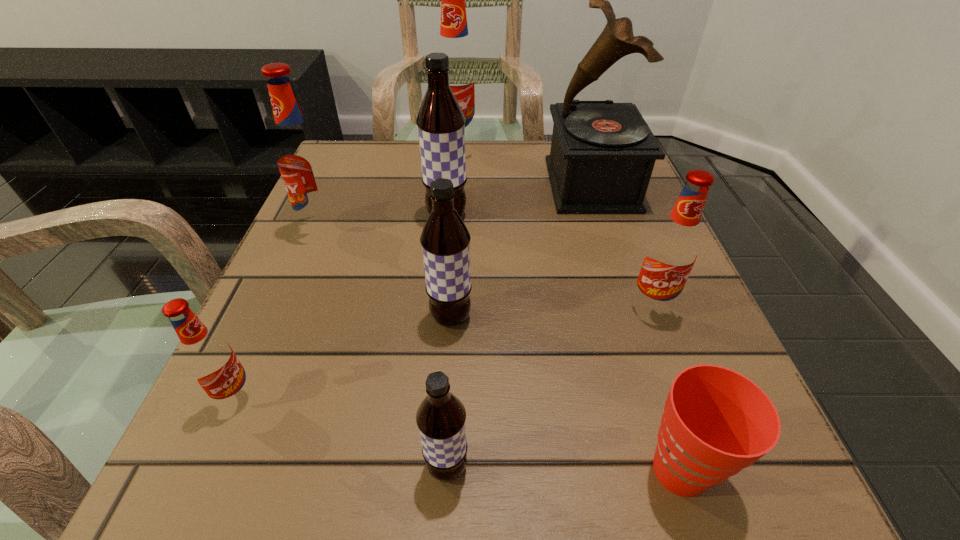
The image size is (960, 540). What are the coordinates of `free space between the smallest red root beer and the rightmost red root beer` in the screenshot? It's located at (444, 352).

Where is `vacant space that is in between the tallest root beer and the nearest red root beer`? This screenshot has height=540, width=960. vacant space that is in between the tallest root beer and the nearest red root beer is located at coordinates (348, 275).

Find the location of a particular element. This screenshot has width=960, height=540. free area in between the nearest root beer and the shortest object is located at coordinates (564, 469).

Where is `free space between the farthest brown root beer and the phonograph_record`? The image size is (960, 540). free space between the farthest brown root beer and the phonograph_record is located at coordinates (519, 200).

Where is `unoccupied area between the third nearest red root beer and the cup`? The height and width of the screenshot is (540, 960). unoccupied area between the third nearest red root beer and the cup is located at coordinates (501, 349).

Find the location of a particular element. The height and width of the screenshot is (540, 960). free area in between the tallest root beer and the third farthest red root beer is located at coordinates (555, 230).

Identify the location of object that is the second closest to the second farthest red root beer. The image size is (960, 540). (445, 239).

Where is `object identified as the closest to the nearest red root beer`? object identified as the closest to the nearest red root beer is located at coordinates (445, 239).

Identify which root beer is the third nearest to the third nearest red root beer. Please provide its 2D coordinates. Your answer should be formatted as a tuple, i.e. [(x, y)], where the tuple contains the x and y coordinates of a point satisfying the conditions above.

[(454, 40)]

What are the coordinates of `root beer that is the fifth closest one to the phonograph_record` in the screenshot? It's located at coord(302,160).